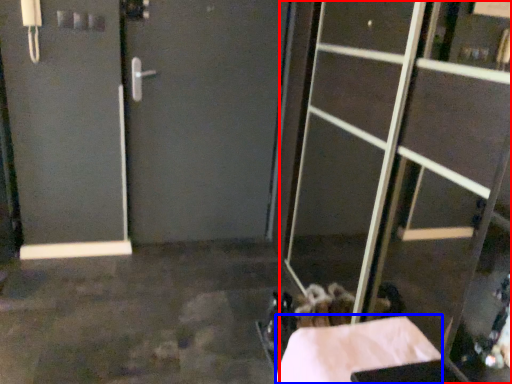
Question: Among these objects, which one is nearest to the camera, glass door (highlighted by a red box) or concrete (highlighted by a blue box)?

Choices:
 (A) glass door
 (B) concrete

Answer: (A)